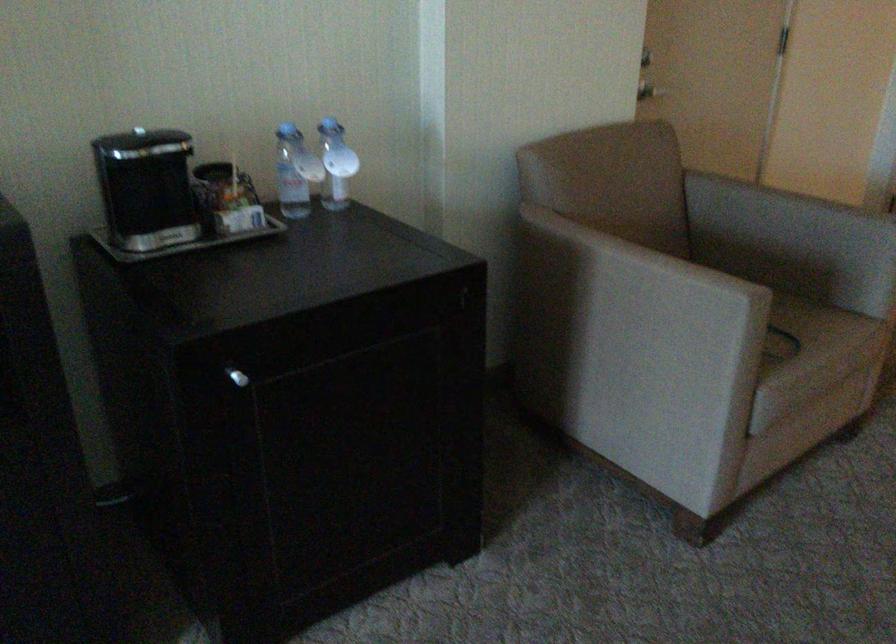
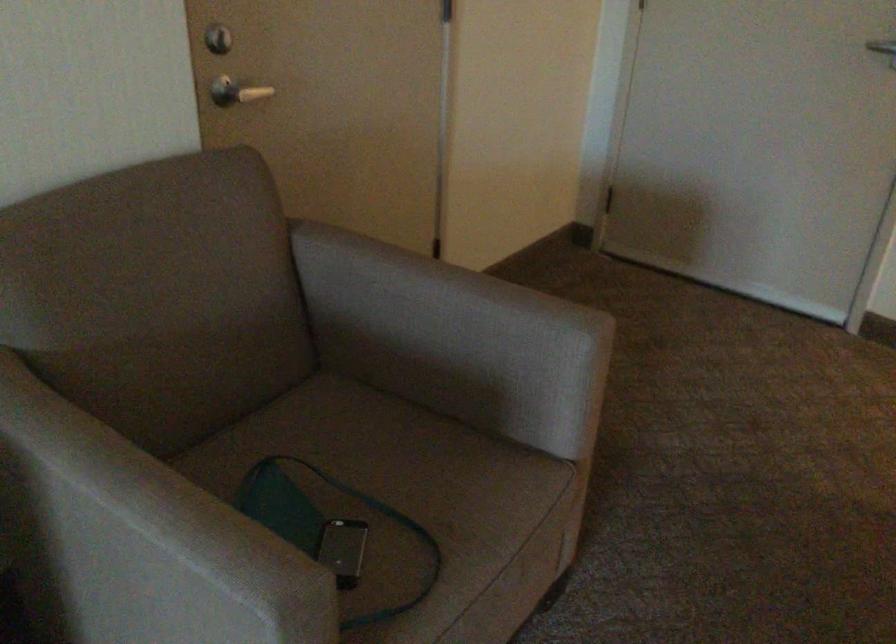
Find the pixel in the second image that matches point (658, 270) in the first image.

(150, 538)